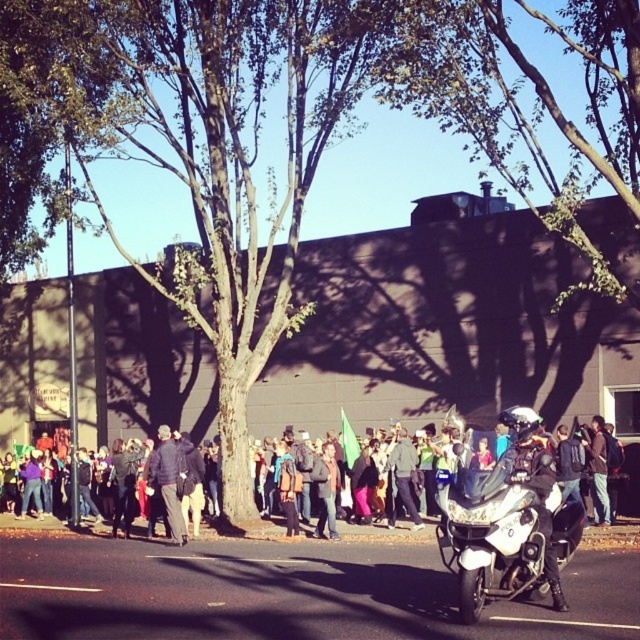
You are standing at the point marked as point (33, 528) in the image. Looking around, you see a denim jacket at center. Which direction should you walk to reach the tree with a slender trunk and sparse foliage?

The denim jacket at center is located at point (33, 528). To reach the tree with a slender trunk and sparse foliage, you should walk away from the building in the background towards the foreground where the tree is situated.

You are standing at the point with coordinates point [180,477] and want to walk towards the building in the background. Is the point point [634,531] blocking your path?

Point [634,531] is in front of point [180,477], so it is blocking your path to the building in the background.